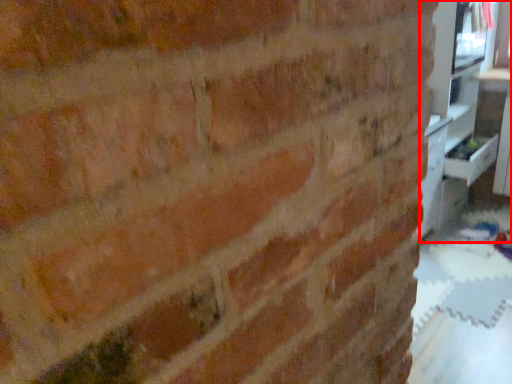
Question: In this image, where is entertainment center (annotated by the red box) located relative to drawer?

Choices:
 (A) right
 (B) left

Answer: (B)